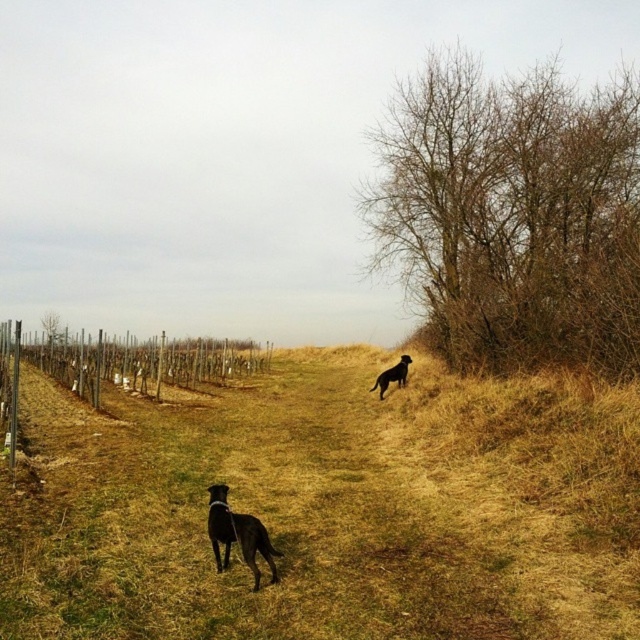
Is point (504, 337) closer to camera compared to point (96, 362)?

That is True.

Image resolution: width=640 pixels, height=640 pixels. I want to click on bare branches at upper right, so click(x=513, y=212).

Which is behind, point (326, 458) or point (10, 433)?

Positioned behind is point (326, 458).

Identify the location of dry grass at center. (328, 508).

Is dry grass at center bigger than bare branches at upper right?

Incorrect, dry grass at center is not larger than bare branches at upper right.

In the scene shown: Which is below, dry grass at center or bare branches at upper right?

dry grass at center is below.

Which is in front, point (141, 621) or point (493, 104)?

Positioned in front is point (141, 621).

I want to click on dry grass at center, so click(x=328, y=508).